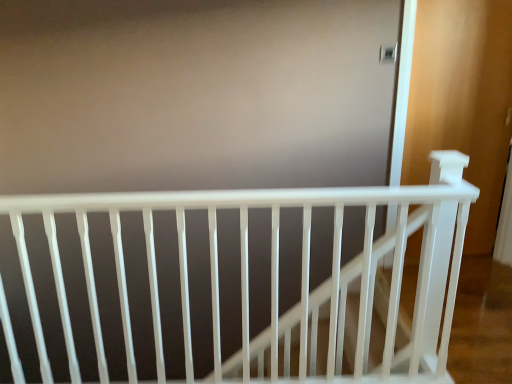
This screenshot has width=512, height=384. What are the coordinates of `white matte screen door at right` in the screenshot? It's located at (463, 101).

What do you see at coordinates (463, 101) in the screenshot? This screenshot has width=512, height=384. I see `white matte screen door at right` at bounding box center [463, 101].

Locate an element on the screen. This screenshot has height=384, width=512. white matte screen door at right is located at coordinates [463, 101].